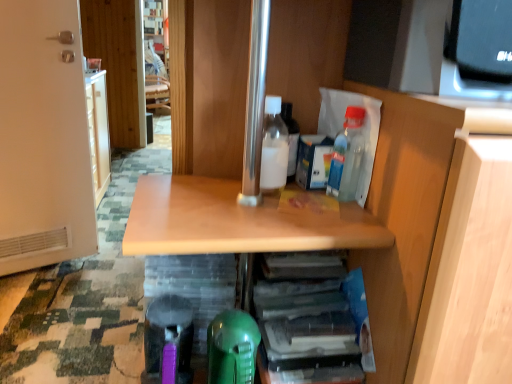
What do you see at coordinates (308, 321) in the screenshot? I see `translucent plastic stack of papers at lower center` at bounding box center [308, 321].

The image size is (512, 384). What are the coordinates of `white matte door at left` in the screenshot? It's located at 42,137.

The height and width of the screenshot is (384, 512). I want to click on translucent plastic stack of papers at lower center, so click(308, 321).

Based on the photo, who is shorter, translucent plastic stack of papers at lower center or white matte door at left?

With less height is translucent plastic stack of papers at lower center.

Can you tell me how much translucent plastic stack of papers at lower center and white matte door at left differ in facing direction?

The facing directions of translucent plastic stack of papers at lower center and white matte door at left are 25.1 degrees apart.

Would you say translucent plastic stack of papers at lower center is a long distance from white matte door at left?

Absolutely, translucent plastic stack of papers at lower center is distant from white matte door at left.

Can you confirm if translucent plastic stack of papers at lower center is positioned to the left of white matte door at left?

No, translucent plastic stack of papers at lower center is not to the left of white matte door at left.

Which object is wider, white matte bottle at center, which is the second bottle in right-to-left order, or white matte door at left?

white matte door at left is wider.

Can you confirm if white matte bottle at center, placed as the 1th bottle when sorted from left to right, is positioned to the right of white matte door at left?

Yes, white matte bottle at center, placed as the 1th bottle when sorted from left to right, is to the right of white matte door at left.

Would you consider white matte bottle at center, placed as the 1th bottle when sorted from left to right, to be distant from white matte door at left?

Yes, white matte bottle at center, placed as the 1th bottle when sorted from left to right, and white matte door at left are quite far apart.

Consider the image. Does white matte bottle at center, placed as the 1th bottle when sorted from left to right, have a lesser height compared to white matte door at left?

Indeed, white matte bottle at center, placed as the 1th bottle when sorted from left to right, has a lesser height compared to white matte door at left.

Based on their positions, is white matte bottle at center, placed as the 1th bottle when sorted from left to right, located to the left or right of translucent plastic bottle at upper right, placed as the second bottle when sorted from left to right?

Based on their positions, white matte bottle at center, placed as the 1th bottle when sorted from left to right, is located to the left of translucent plastic bottle at upper right, placed as the second bottle when sorted from left to right.

At what (x,y) coordinates should I click in order to perform the action: click on bottle that is under the translucent plastic bottle at upper right, placed as the second bottle when sorted from left to right (from a real-world perspective). Please return your answer as a coordinate pair (x, y). Image resolution: width=512 pixels, height=384 pixels. Looking at the image, I should click on (274, 148).

Is white matte bottle at center, which is the second bottle in right-to-left order, with translucent plastic bottle at upper right, which appears as the 1th bottle when viewed from the right?

Indeed, white matte bottle at center, which is the second bottle in right-to-left order, and translucent plastic bottle at upper right, which appears as the 1th bottle when viewed from the right, are beside each other and touching.

Considering the sizes of objects translucent plastic stack of papers at lower center and white matte bottle at center, which is the second bottle in right-to-left order, in the image provided, who is shorter, translucent plastic stack of papers at lower center or white matte bottle at center, which is the second bottle in right-to-left order,?

With less height is translucent plastic stack of papers at lower center.

Is translucent plastic stack of papers at lower center at the right side of white matte bottle at center, placed as the 1th bottle when sorted from left to right?

Correct, you'll find translucent plastic stack of papers at lower center to the right of white matte bottle at center, placed as the 1th bottle when sorted from left to right.

Which of these two, translucent plastic stack of papers at lower center or white matte bottle at center, which is the second bottle in right-to-left order, is smaller?

With smaller size is white matte bottle at center, which is the second bottle in right-to-left order.

Looking at their sizes, would you say translucent plastic stack of papers at lower center is wider or thinner than white matte bottle at center, placed as the 1th bottle when sorted from left to right?

Considering their sizes, translucent plastic stack of papers at lower center looks broader than white matte bottle at center, placed as the 1th bottle when sorted from left to right.

Could you tell me if white matte door at left is turned towards white matte bottle at center, placed as the 1th bottle when sorted from left to right?

Yes, white matte door at left is aimed at white matte bottle at center, placed as the 1th bottle when sorted from left to right.

Which is in front, white matte door at left or white matte bottle at center, placed as the 1th bottle when sorted from left to right?

white matte bottle at center, placed as the 1th bottle when sorted from left to right, is in front.

Is white matte door at left positioned far away from white matte bottle at center, which is the second bottle in right-to-left order?

A: Yes.

Considering the sizes of objects white matte door at left and white matte bottle at center, placed as the 1th bottle when sorted from left to right, in the image provided, who is thinner, white matte door at left or white matte bottle at center, placed as the 1th bottle when sorted from left to right,?

white matte bottle at center, placed as the 1th bottle when sorted from left to right, is thinner.

Which of these two, translucent plastic bottle at upper right, placed as the second bottle when sorted from left to right, or translucent plastic stack of papers at lower center, is wider?

translucent plastic stack of papers at lower center.

Which object is more forward, translucent plastic bottle at upper right, placed as the second bottle when sorted from left to right, or translucent plastic stack of papers at lower center?

translucent plastic bottle at upper right, placed as the second bottle when sorted from left to right, is more forward.

From the picture: Does translucent plastic bottle at upper right, placed as the second bottle when sorted from left to right, touch translucent plastic stack of papers at lower center?

They are not placed beside each other.

Does point (331, 178) lie in front of point (351, 361)?

No, it is not.

Consider the image. Is white matte bottle at center, which is the second bottle in right-to-left order, taller or shorter than translucent plastic stack of papers at lower center?

white matte bottle at center, which is the second bottle in right-to-left order, is taller than translucent plastic stack of papers at lower center.

Between white matte bottle at center, placed as the 1th bottle when sorted from left to right, and translucent plastic stack of papers at lower center, which one has smaller size?

With smaller size is white matte bottle at center, placed as the 1th bottle when sorted from left to right.

Is white matte bottle at center, placed as the 1th bottle when sorted from left to right, far from translucent plastic stack of papers at lower center?

white matte bottle at center, placed as the 1th bottle when sorted from left to right, is near translucent plastic stack of papers at lower center, not far away.

In the image, is white matte bottle at center, placed as the 1th bottle when sorted from left to right, positioned in front of or behind translucent plastic stack of papers at lower center?

Visually, white matte bottle at center, placed as the 1th bottle when sorted from left to right, is located behind translucent plastic stack of papers at lower center.

At what (x,y) coordinates should I click in order to perform the action: click on door above the translucent plastic stack of papers at lower center (from the image's perspective). Please return your answer as a coordinate pair (x, y). Image resolution: width=512 pixels, height=384 pixels. Looking at the image, I should click on (42, 137).

Locate an element on the screen. The height and width of the screenshot is (384, 512). the 1st bottle in front of the white matte door at left is located at coordinates (274, 148).

From the image, which object appears to be farther from white matte bottle at center, which is the second bottle in right-to-left order, white matte door at left or translucent plastic bottle at upper right, which appears as the 1th bottle when viewed from the right?

white matte door at left is further to white matte bottle at center, which is the second bottle in right-to-left order.

Which object lies nearer to the anchor point white matte door at left, translucent plastic stack of papers at lower center or white matte bottle at center, placed as the 1th bottle when sorted from left to right?

The object closer to white matte door at left is white matte bottle at center, placed as the 1th bottle when sorted from left to right.

From the image, which object appears to be farther from translucent plastic stack of papers at lower center, white matte door at left or white matte bottle at center, which is the second bottle in right-to-left order?

The object further to translucent plastic stack of papers at lower center is white matte door at left.

Considering their positions, is white matte bottle at center, placed as the 1th bottle when sorted from left to right, positioned closer to translucent plastic bottle at upper right, which appears as the 1th bottle when viewed from the right, than white matte door at left?

white matte bottle at center, placed as the 1th bottle when sorted from left to right.

Based on their spatial positions, is translucent plastic bottle at upper right, which appears as the 1th bottle when viewed from the right, or white matte door at left further from translucent plastic stack of papers at lower center?

white matte door at left lies further to translucent plastic stack of papers at lower center than the other object.

Estimate the real-world distances between objects in this image. Which object is further from white matte bottle at center, which is the second bottle in right-to-left order, translucent plastic bottle at upper right, which appears as the 1th bottle when viewed from the right, or translucent plastic stack of papers at lower center?

translucent plastic stack of papers at lower center is further to white matte bottle at center, which is the second bottle in right-to-left order.

Based on the photo, based on their spatial positions, is translucent plastic bottle at upper right, which appears as the 1th bottle when viewed from the right, or white matte bottle at center, which is the second bottle in right-to-left order, further from translucent plastic stack of papers at lower center?

Based on the image, white matte bottle at center, which is the second bottle in right-to-left order, appears to be further to translucent plastic stack of papers at lower center.

When comparing their distances from translucent plastic bottle at upper right, which appears as the 1th bottle when viewed from the right, does white matte door at left or translucent plastic stack of papers at lower center seem further?

white matte door at left is further to translucent plastic bottle at upper right, which appears as the 1th bottle when viewed from the right.

The image size is (512, 384). I want to click on bottle between white matte door at left and translucent plastic stack of papers at lower center from left to right, so click(274, 148).

The width and height of the screenshot is (512, 384). What are the coordinates of `bottle between white matte bottle at center, placed as the 1th bottle when sorted from left to right, and translucent plastic stack of papers at lower center from top to bottom` in the screenshot? It's located at [347, 156].

The image size is (512, 384). Identify the location of bottle between white matte door at left and translucent plastic bottle at upper right, placed as the second bottle when sorted from left to right, in the horizontal direction. (274, 148).

This screenshot has height=384, width=512. I want to click on shelf between white matte door at left and translucent plastic bottle at upper right, placed as the second bottle when sorted from left to right, from left to right, so click(x=308, y=321).